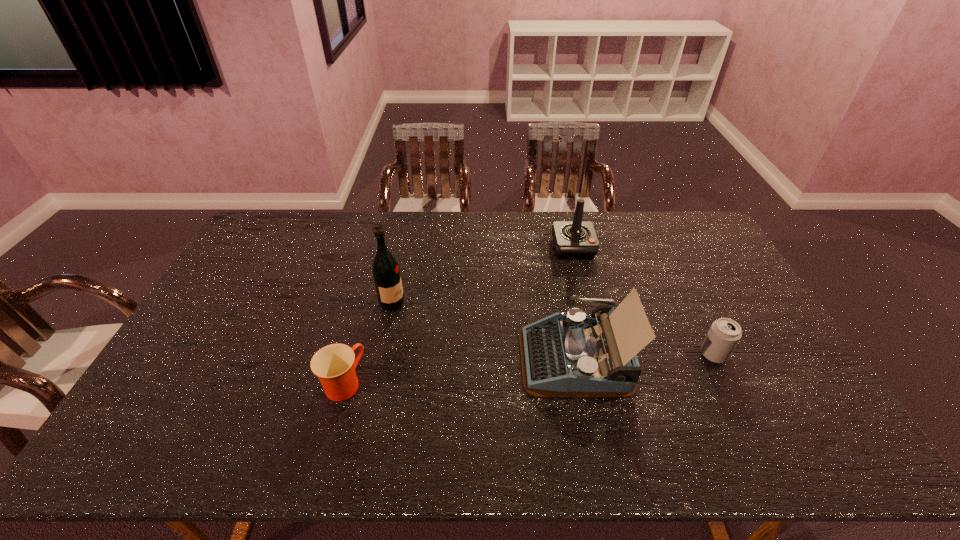
Where is `vacant point located 0.270m on the typing side of the typewriter`? vacant point located 0.270m on the typing side of the typewriter is located at coordinates (424, 357).

What are the coordinates of `free space located on the back of the can` in the screenshot? It's located at (684, 295).

Locate an element on the screen. The height and width of the screenshot is (540, 960). vacant region located 0.270m on the right of the cup is located at coordinates (466, 383).

Where is `object at the far edge`? The image size is (960, 540). object at the far edge is located at coordinates (572, 239).

Where is `object at the right edge`? This screenshot has width=960, height=540. object at the right edge is located at coordinates (724, 334).

Find the location of `vacant position at the far edge of the desktop`. vacant position at the far edge of the desktop is located at coordinates (468, 222).

In the image, there is a desktop. At what (x,y) coordinates should I click in order to perform the action: click on free space at the left edge. Please return your answer as a coordinate pair (x, y). The width and height of the screenshot is (960, 540). Looking at the image, I should click on [x=271, y=255].

This screenshot has width=960, height=540. Identify the location of vacant region at the right edge. (707, 281).

In the image, there is a desktop. Where is `vacant space at the near left corner`? The width and height of the screenshot is (960, 540). vacant space at the near left corner is located at coordinates tap(165, 455).

I want to click on free spot between the can and the joystick, so tap(643, 301).